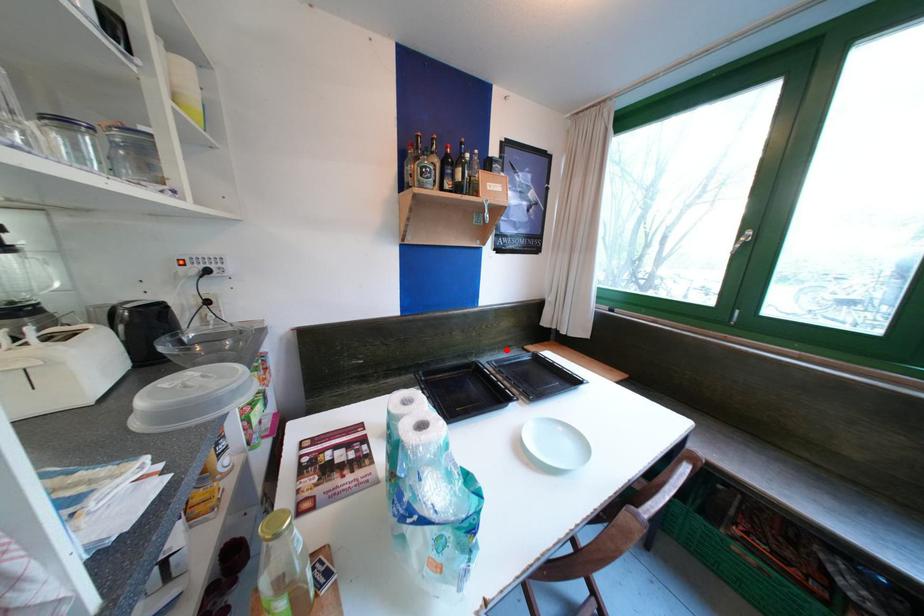
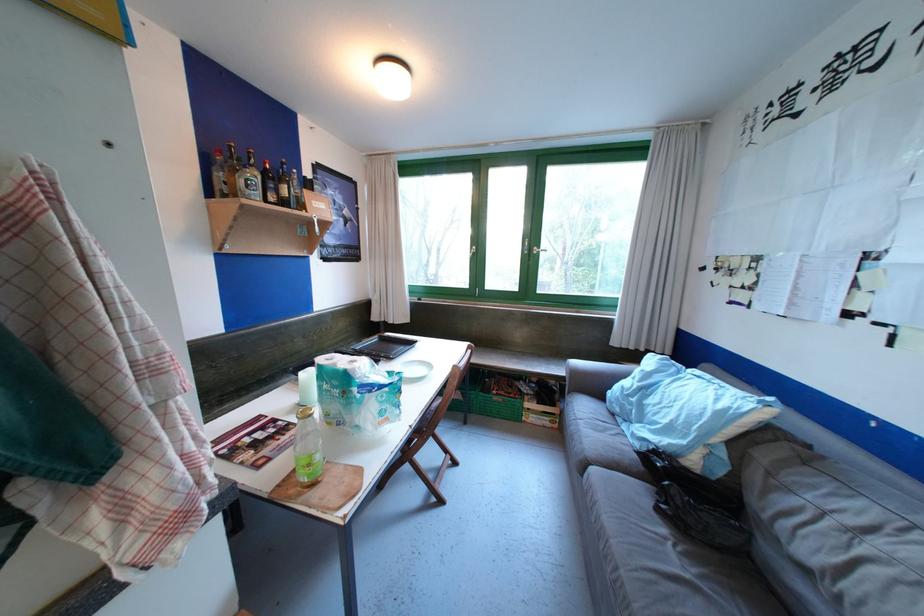
Question: I am providing you with two images of the same scene from different viewpoints. A red point is marked on the first image. Is the red point's position out of view in image 2?

Choices:
 (A) Yes
 (B) No

Answer: (B)